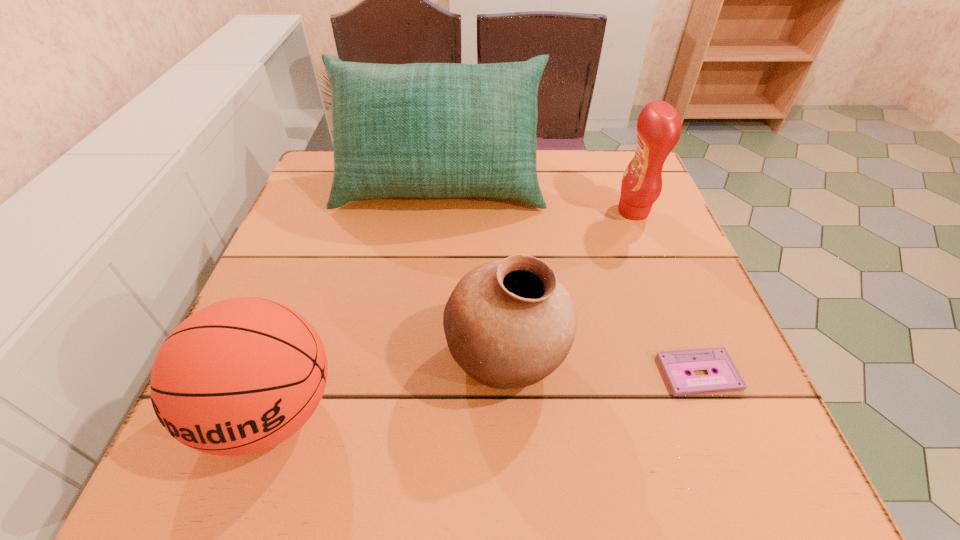
Where is `vacant region between the pottery and the videotape`? Image resolution: width=960 pixels, height=540 pixels. vacant region between the pottery and the videotape is located at coordinates (602, 367).

Image resolution: width=960 pixels, height=540 pixels. Identify the location of vacant space in between the condiment and the shortest object. (666, 292).

Locate an element on the screen. vacant space that is in between the videotape and the cushion is located at coordinates (569, 280).

Identify which object is the closest to the pottery. Please provide its 2D coordinates. Your answer should be formatted as a tuple, i.e. [(x, y)], where the tuple contains the x and y coordinates of a point satisfying the conditions above.

[(675, 364)]

Identify which object is located as the second nearest to the cushion. Please provide its 2D coordinates. Your answer should be formatted as a tuple, i.e. [(x, y)], where the tuple contains the x and y coordinates of a point satisfying the conditions above.

[(509, 323)]

The image size is (960, 540). I want to click on free region that satisfies the following two spatial constraints: 1. on the back side of the videotape; 2. on the label side of the condiment, so click(635, 211).

The image size is (960, 540). I want to click on free space that satisfies the following two spatial constraints: 1. on the front-facing side of the cushion; 2. on the left side of the videotape, so click(x=420, y=373).

Find the location of a particular element. The width and height of the screenshot is (960, 540). free location that satisfies the following two spatial constraints: 1. on the label side of the shortest object; 2. on the left side of the condiment is located at coordinates (697, 373).

Image resolution: width=960 pixels, height=540 pixels. I want to click on vacant space that satisfies the following two spatial constraints: 1. on the front-facing side of the videotape; 2. on the right side of the cushion, so click(x=420, y=373).